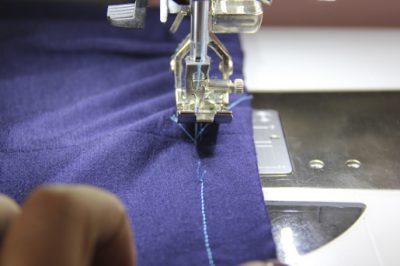
The width and height of the screenshot is (400, 266). I want to click on purple fabric, so click(145, 189).